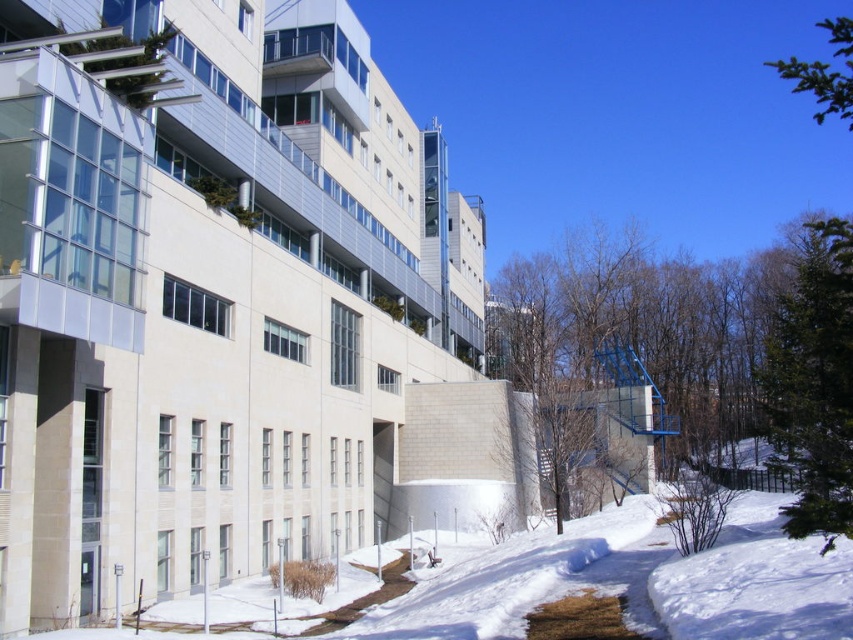
You are standing at the bottom of the snow path and want to know which tree is taller between the green leafy tree at right and the green textured evergreen tree at right. Can you tell me which one is taller?

The green leafy tree at right is much taller than the green textured evergreen tree at right.